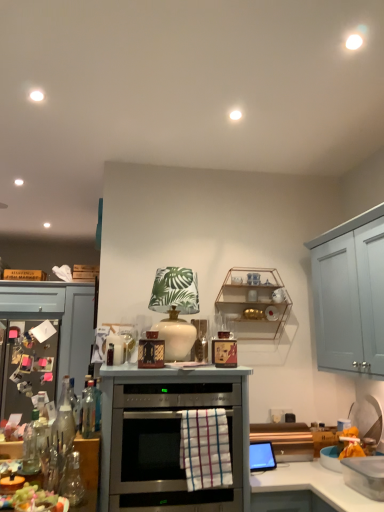
Question: Is clear glass bottle at lower left, the 1th bottle when ordered from left to right, far from translucent glass grapes at lower left?

Choices:
 (A) no
 (B) yes

Answer: (A)

Question: Is translucent glass grapes at lower left at the back of clear glass bottle at lower left, the second bottle viewed from the right?

Choices:
 (A) no
 (B) yes

Answer: (A)

Question: Can you confirm if clear glass bottle at lower left, the 1th bottle when ordered from left to right, is shorter than translucent glass grapes at lower left?

Choices:
 (A) yes
 (B) no

Answer: (B)

Question: Is clear glass bottle at lower left, the second bottle viewed from the right, positioned beyond the bounds of translucent glass grapes at lower left?

Choices:
 (A) no
 (B) yes

Answer: (B)

Question: Are clear glass bottle at lower left, the 1th bottle when ordered from left to right, and translucent glass grapes at lower left beside each other?

Choices:
 (A) yes
 (B) no

Answer: (B)

Question: Can you confirm if clear glass bottle at lower left, the 1th bottle when ordered from left to right, is smaller than translucent glass grapes at lower left?

Choices:
 (A) no
 (B) yes

Answer: (B)

Question: Does clear plastic container at lower right, which appears as the second appliance when viewed from the top, lie behind translucent glass grapes at lower left?

Choices:
 (A) yes
 (B) no

Answer: (A)

Question: From a real-world perspective, is clear plastic container at lower right, positioned as the 2th appliance in left-to-right order, located beneath translucent glass grapes at lower left?

Choices:
 (A) yes
 (B) no

Answer: (A)

Question: Considering the relative positions of clear plastic container at lower right, marked as the 1th appliance in a right-to-left arrangement, and translucent glass grapes at lower left in the image provided, is clear plastic container at lower right, marked as the 1th appliance in a right-to-left arrangement, to the right of translucent glass grapes at lower left from the viewer's perspective?

Choices:
 (A) no
 (B) yes

Answer: (B)

Question: Is clear plastic container at lower right, the 1th appliance when ordered from bottom to top, oriented towards translucent glass grapes at lower left?

Choices:
 (A) no
 (B) yes

Answer: (B)

Question: Is translucent glass grapes at lower left a part of clear plastic container at lower right, which appears as the second appliance when viewed from the back?

Choices:
 (A) yes
 (B) no

Answer: (B)

Question: Can you confirm if clear plastic container at lower right, marked as the first appliance in a front-to-back arrangement, is positioned to the left of translucent glass grapes at lower left?

Choices:
 (A) no
 (B) yes

Answer: (A)

Question: Is satin silver oven at center to the right of clear plastic container at lower right, marked as the first appliance in a front-to-back arrangement, from the viewer's perspective?

Choices:
 (A) no
 (B) yes

Answer: (A)